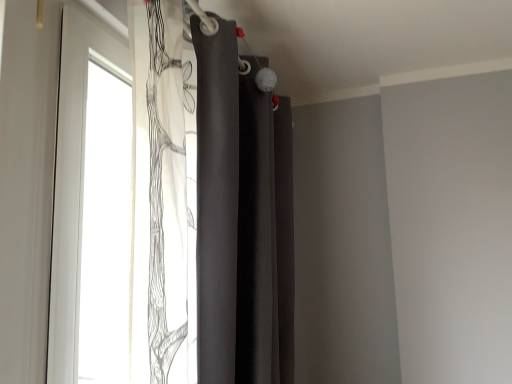
What do you see at coordinates (241, 214) in the screenshot? I see `transparent fabric at left` at bounding box center [241, 214].

Where is `transparent fabric at left`? transparent fabric at left is located at coordinates (241, 214).

At what (x,y) coordinates should I click in order to perform the action: click on transparent fabric at left. Please return your answer as a coordinate pair (x, y). This screenshot has width=512, height=384. Looking at the image, I should click on (241, 214).